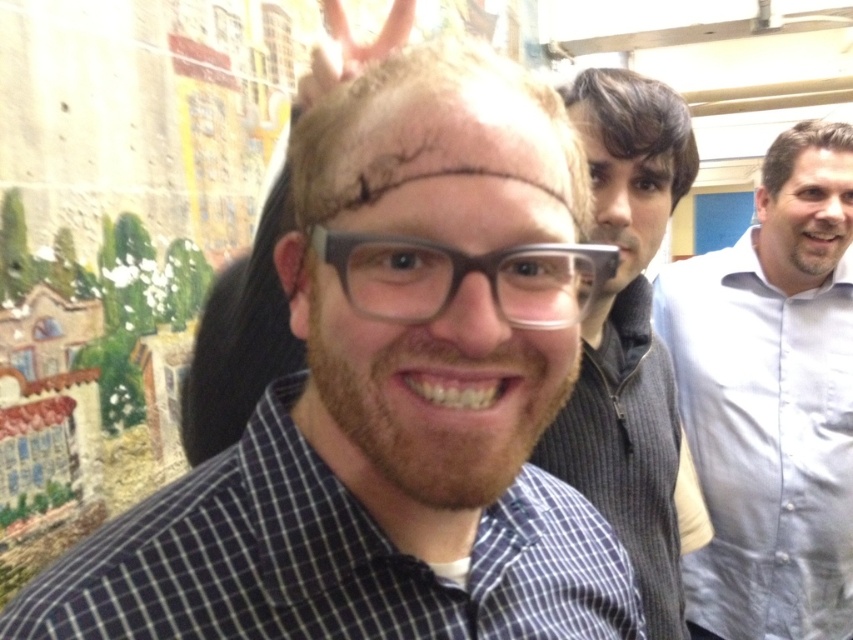
Question: Which object is positioned farthest from the dark brown hair at upper center?

Choices:
 (A) dry skin at center
 (B) light blue shirt at right

Answer: (B)

Question: Is transparent plastic glasses at center to the right of dark brown hair at upper center from the viewer's perspective?

Choices:
 (A) no
 (B) yes

Answer: (A)

Question: Among these objects, which one is farthest from the camera?

Choices:
 (A) dry skin at center
 (B) transparent plastic glasses at center

Answer: (A)

Question: Based on their relative distances, which object is nearer to the light blue shirt at right?

Choices:
 (A) dark brown hair at upper center
 (B) dry skin at center
 (C) transparent plastic glasses at center
 (D) blue checkered shirt at center

Answer: (A)

Question: Does light blue shirt at right have a lesser width compared to gray ribbed sweater at center?

Choices:
 (A) no
 (B) yes

Answer: (A)

Question: Can you confirm if blue checkered shirt at center is bigger than dark brown hair at upper center?

Choices:
 (A) no
 (B) yes

Answer: (B)